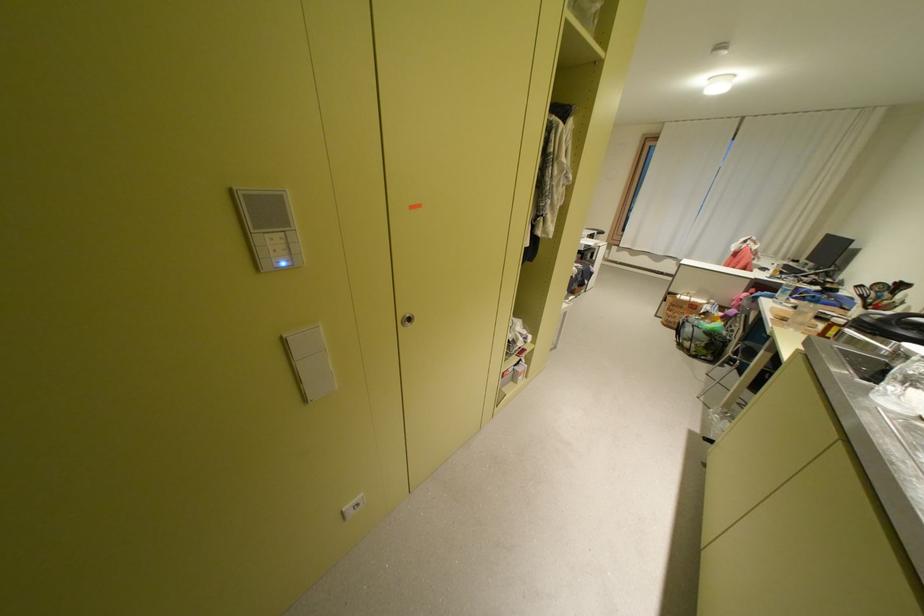
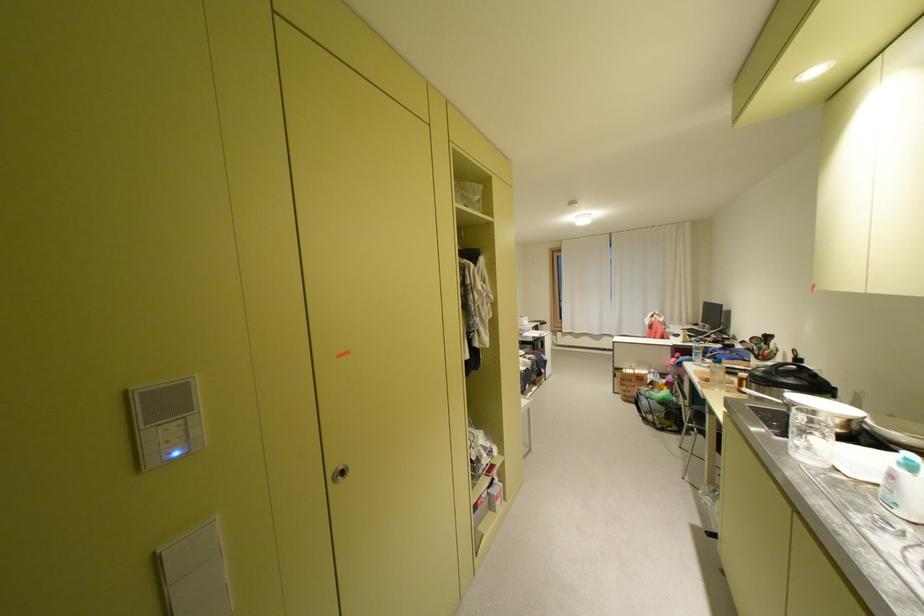
What movement of the cameraman would produce the second image?

The movement direction of the cameraman is right, backward.